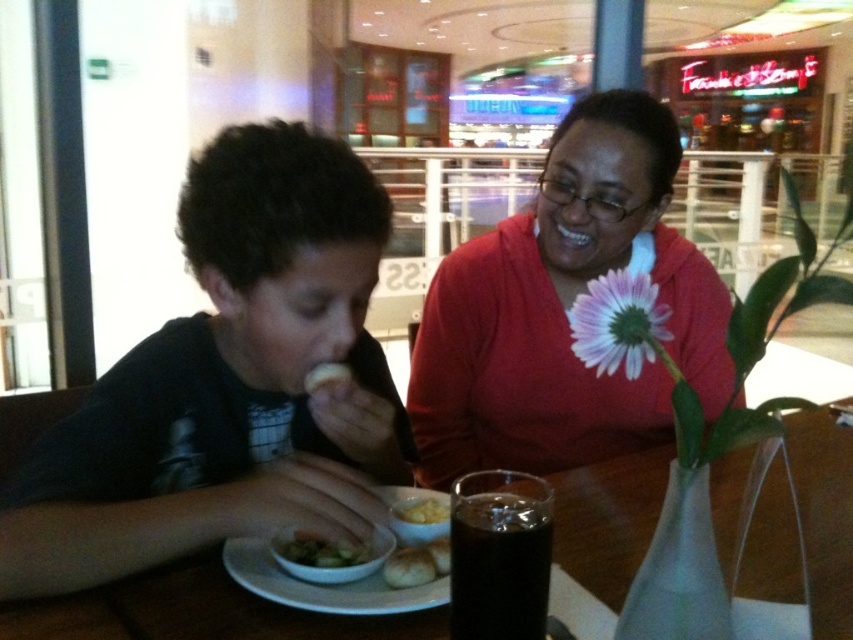
You are a food delivery person who needs to place a new order on the table. The new order is a large pizza box that requires enough space. Considering the dark glass cup at center and white matte bread at lower center, which object should you move to make space?

The dark glass cup at center is larger than the white matte bread at lower center, so you should move the white matte bread at lower center to make space for the pizza box.

You are a food delivery person who needs to place a new order between the green matte salad at center and the golden brown bread at lower center on the table. Which side should you place it on to ensure it doesn

The green matte salad at center is to the left of golden brown bread at lower center, so placing the new order to the right of the salad or to the left of the bread would maintain their current positions.

You are setting up a small tray to carry items from the table. The tray can only hold items that are wider than 10 centimeters. Based on the scene, can both the dark glass cup at center and the green matte salad at center fit on the tray?

The dark glass cup at center has a width less than the green matte salad at center. Since the tray requires items wider than 10 centimeters, only the salad may qualify if its width exceeds 10 cm. However, without specific measurements, we can only confirm the salad is wider than the cup, but cannot definitively say if it meets the 10 cm requirement.